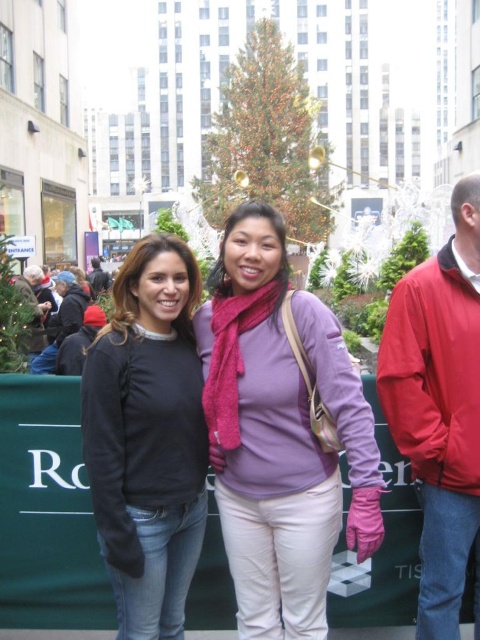
From the picture: You are a photographer trying to capture a photo of the green textured christmas tree at center and the red jacket at right. Based on their positions, which object is closer to the camera?

The red jacket at right is below green textured christmas tree at center, so it is closer to the camera.

You are standing in the festive outdoor scene with the two women posing. You need to place a small gift box exactly at the point marked as point (262, 506). Considering the distance from where you are standing, will you be able to reach that point to place the gift box?

The point (262, 506) is 31.45 meters away from the viewer. Since this distance is quite far, placing the gift box at that exact point may be challenging without assistance or specialized equipment.

You are standing in the holiday scene and want to take a photo of both the matte black sweater at center and the red jacket at right. Which object should you focus on first if you want to capture both in the same frame without moving the camera?

You should focus on the matte black sweater at center first because it is located below the red jacket at right, ensuring both are in the frame when centered on the lower object.